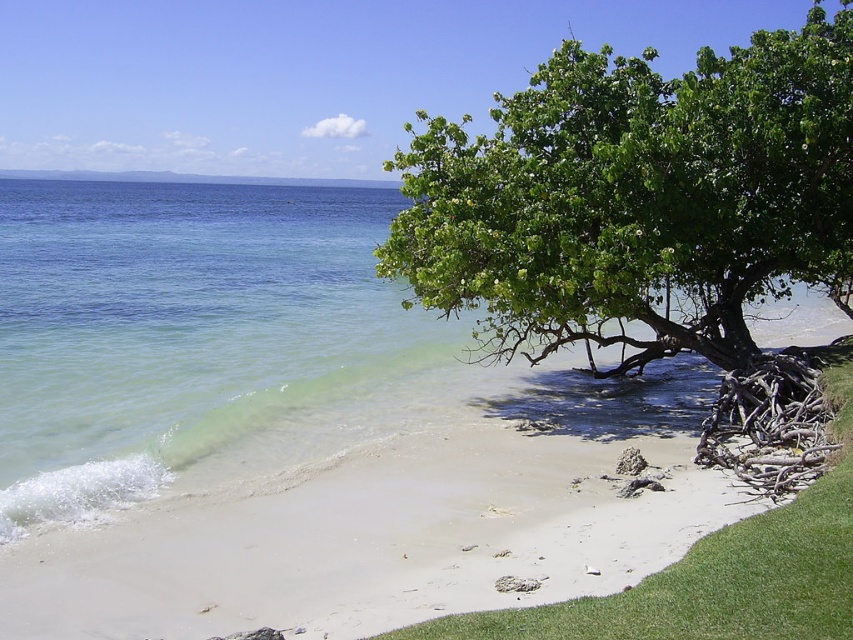
Who is positioned more to the right, white sand at lower right or green leafy tree at upper right?

From the viewer's perspective, green leafy tree at upper right appears more on the right side.

Find the location of `white sand at lower right`. white sand at lower right is located at coordinates point(329,486).